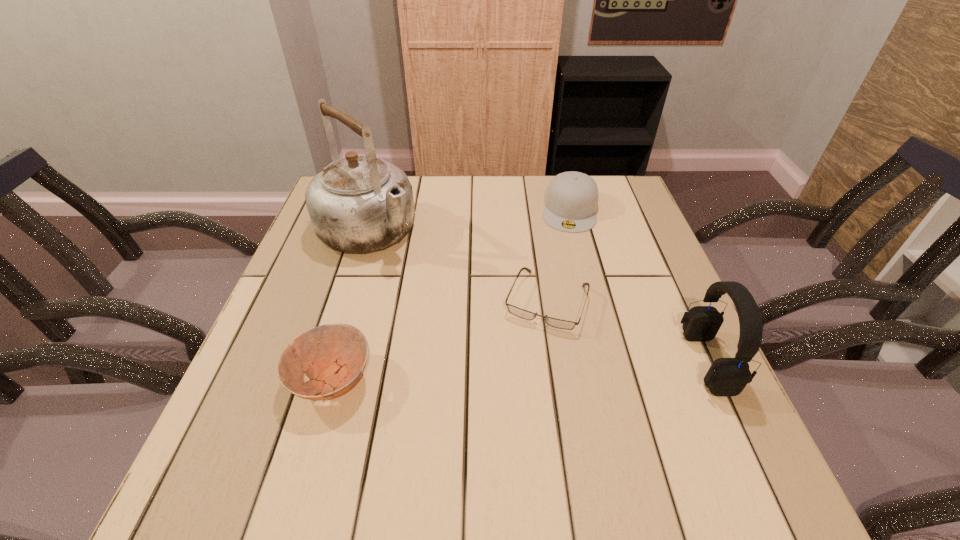
In the image, there is a desktop. At what (x,y) coordinates should I click in order to perform the action: click on vacant space at the left edge. Please return your answer as a coordinate pair (x, y). Looking at the image, I should click on pyautogui.click(x=241, y=386).

Find the location of a particular element. This screenshot has width=960, height=540. free location at the near left corner of the desktop is located at coordinates tap(312, 403).

Identify the location of vacant space at the far right corner of the desktop. The height and width of the screenshot is (540, 960). pyautogui.click(x=622, y=198).

This screenshot has height=540, width=960. In order to click on empty space between the shortest object and the tallest object in this screenshot , I will do `click(457, 266)`.

This screenshot has height=540, width=960. I want to click on free area in between the spectacles and the third tallest object, so click(x=558, y=255).

The image size is (960, 540). I want to click on empty space between the cap and the bowl, so click(x=451, y=294).

Where is `vacant space in between the bowl and the tallest object`? Image resolution: width=960 pixels, height=540 pixels. vacant space in between the bowl and the tallest object is located at coordinates (350, 305).

The width and height of the screenshot is (960, 540). I want to click on vacant area that lies between the bowl and the tallest object, so click(x=350, y=305).

You are a GUI agent. You are given a task and a screenshot of the screen. Output one action in this format:
    pyautogui.click(x=<x>, y=<y>)
    Task: Click on the free space between the cap and the tallest object
    The width and height of the screenshot is (960, 540).
    Given the screenshot: What is the action you would take?
    pyautogui.click(x=469, y=220)

Find the location of `vacant region between the kettle and the second tallest object`. vacant region between the kettle and the second tallest object is located at coordinates (538, 296).